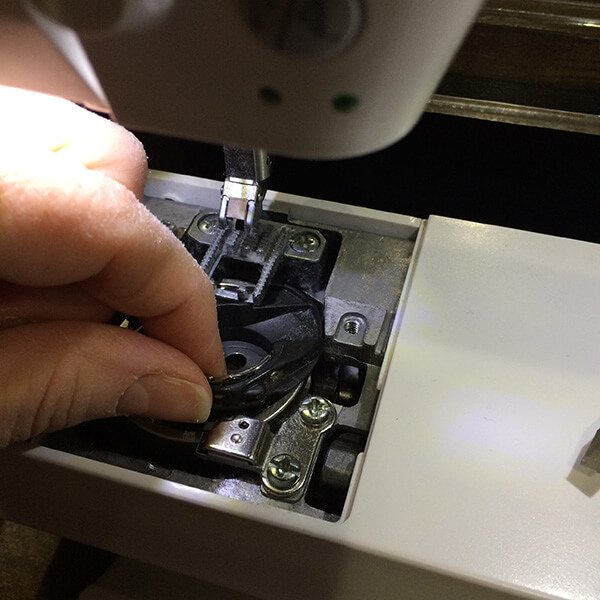
Find the location of `screws`. screws is located at coordinates (287, 467), (319, 404), (306, 245), (210, 225).